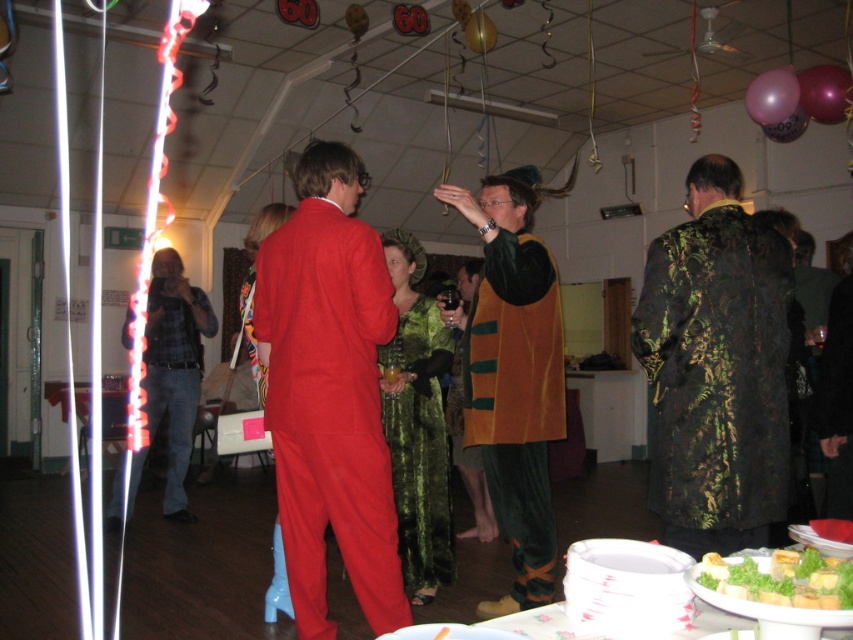
Question: Where is plaid flannel shirt at left located in relation to green leafy garnish at lower right in the image?

Choices:
 (A) below
 (B) above

Answer: (A)

Question: Which of the following is the closest to the observer?

Choices:
 (A) [x=451, y=384]
 (B) [x=781, y=132]

Answer: (B)

Question: Can you confirm if velvet green coat at right is bigger than green velvet dress at center?

Choices:
 (A) yes
 (B) no

Answer: (B)

Question: Among these points, which one is farthest from the camera?

Choices:
 (A) (727, 566)
 (B) (787, 99)
 (C) (366, 550)
 (D) (169, 380)

Answer: (D)

Question: Which point appears farthest from the camera in this image?

Choices:
 (A) (502, 400)
 (B) (480, 508)

Answer: (B)

Question: Is translucent plastic balloon at upper right bigger than pink glossy balloon at upper right?

Choices:
 (A) no
 (B) yes

Answer: (B)